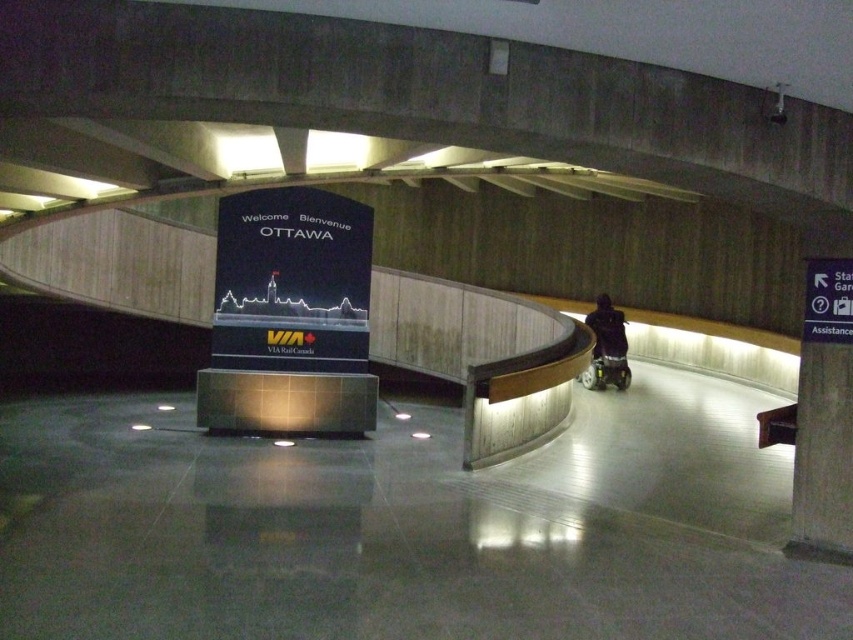
Who is higher up, dark blue jacket at center or metallic silver baby carriage at lower right?

dark blue jacket at center

Which is behind, point (622, 321) or point (607, 355)?

Positioned behind is point (622, 321).

Where is `dark blue jacket at center`? dark blue jacket at center is located at coordinates (607, 328).